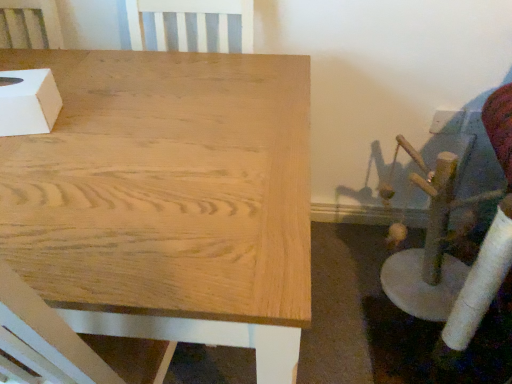
At what (x,y) coordinates should I click in order to perform the action: click on free space above natural wood table at center (from a real-world perspective). Please return your answer as a coordinate pair (x, y). The width and height of the screenshot is (512, 384). Looking at the image, I should click on (122, 125).